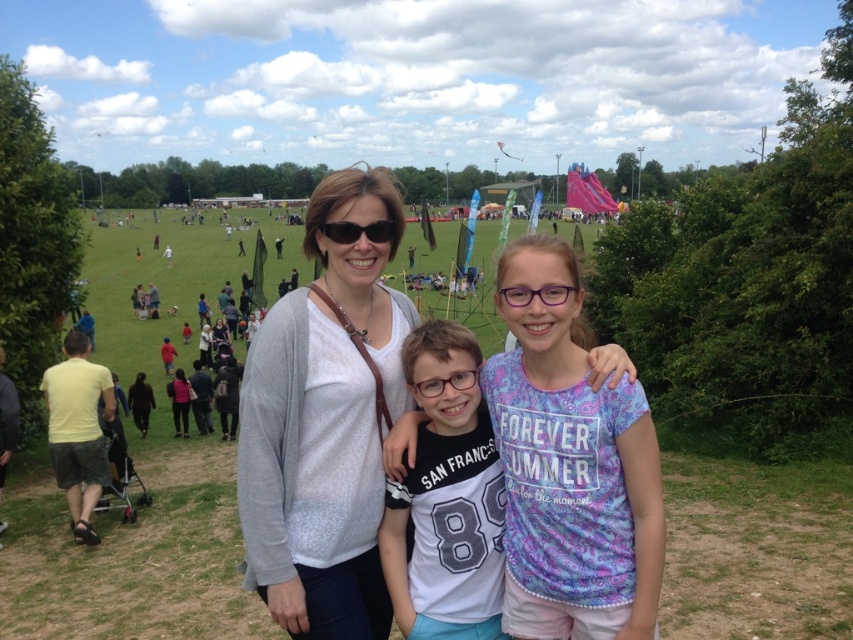
Between gray sweater at center and white cotton shirt at center, which one has less height?

Standing shorter between the two is white cotton shirt at center.

Is gray sweater at center taller than white cotton shirt at center?

Indeed, gray sweater at center has a greater height compared to white cotton shirt at center.

Image resolution: width=853 pixels, height=640 pixels. What do you see at coordinates (323, 422) in the screenshot?
I see `gray sweater at center` at bounding box center [323, 422].

Identify the location of gray sweater at center. (323, 422).

Between white cotton shirt at center and clear plastic glasses at center, which one is positioned lower?

Positioned lower is white cotton shirt at center.

Is white cotton shirt at center to the left of clear plastic glasses at center from the viewer's perspective?

No, white cotton shirt at center is not to the left of clear plastic glasses at center.

Locate an element on the screen. The image size is (853, 640). white cotton shirt at center is located at coordinates (573, 467).

This screenshot has height=640, width=853. What are the coordinates of `white cotton shirt at center` in the screenshot? It's located at (573, 467).

Does white jersey at center have a larger size compared to purple plastic glasses at center?

Yes, white jersey at center is bigger than purple plastic glasses at center.

Is white jersey at center wider than purple plastic glasses at center?

Correct, the width of white jersey at center exceeds that of purple plastic glasses at center.

Between point (381, 554) and point (514, 285), which one is positioned in front?

Point (514, 285)

I want to click on white jersey at center, so click(x=445, y=497).